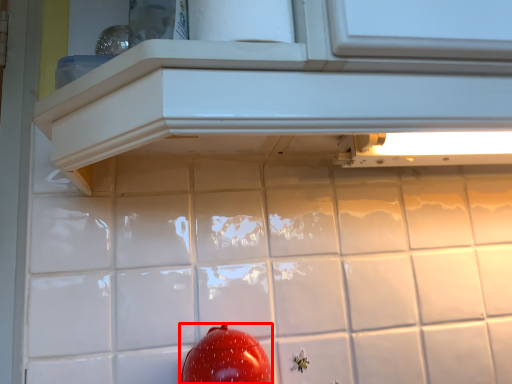
Question: From the image's perspective, where is tomato (annotated by the red box) located relative to cabinetry?

Choices:
 (A) above
 (B) below

Answer: (B)